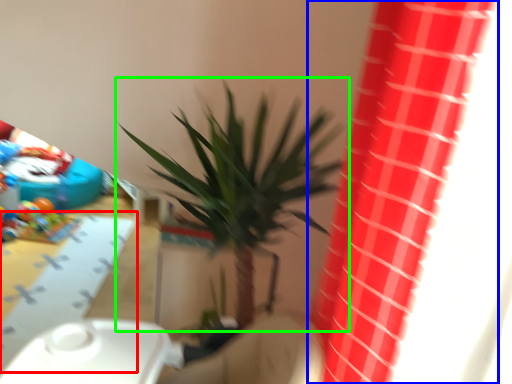
Question: Based on their relative distances, which object is farther from table (highlighted by a red box)? Choose from curtain (highlighted by a blue box) and houseplant (highlighted by a green box).

Choices:
 (A) curtain
 (B) houseplant

Answer: (A)